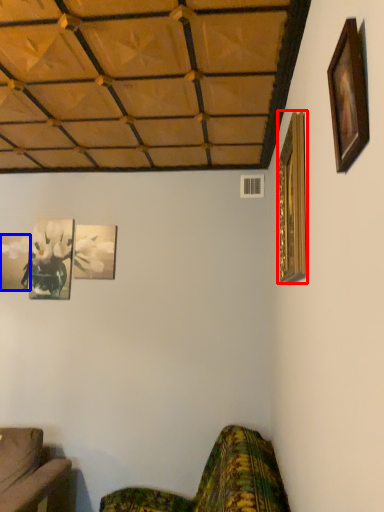
Question: Among these objects, which one is farthest to the camera, picture frame (highlighted by a red box) or picture frame (highlighted by a blue box)?

Choices:
 (A) picture frame
 (B) picture frame

Answer: (B)